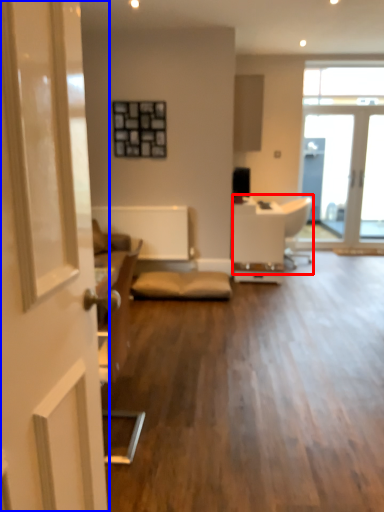
Question: Among these objects, which one is nearest to the camera, armchair (highlighted by a red box) or door (highlighted by a blue box)?

Choices:
 (A) armchair
 (B) door

Answer: (B)